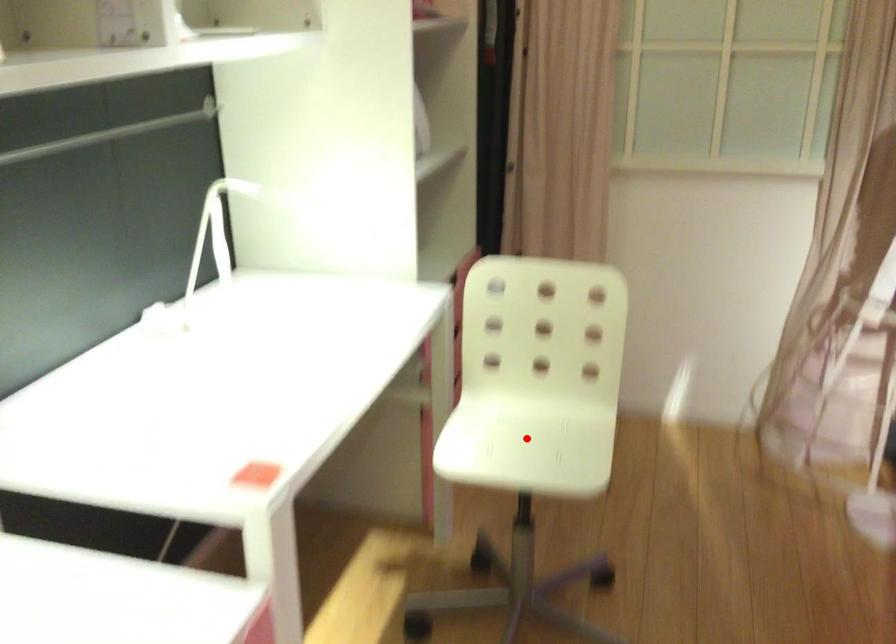
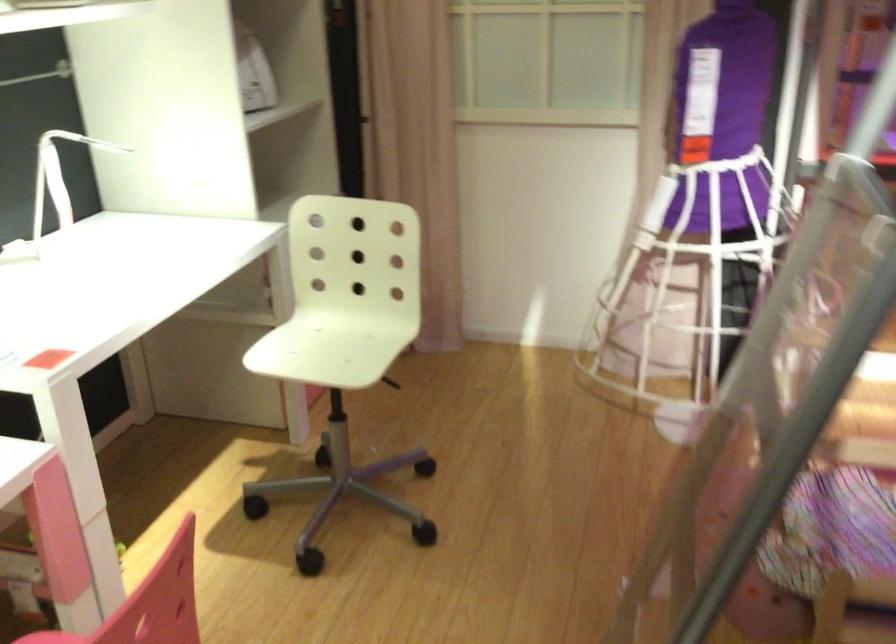
Question: A red point is marked in image1. In image2, is the corresponding 3D point closer to the camera or farther? Reply with the corresponding letter.

Choices:
 (A) The corresponding 3D point is closer.
 (B) The corresponding 3D point is farther.

Answer: (B)